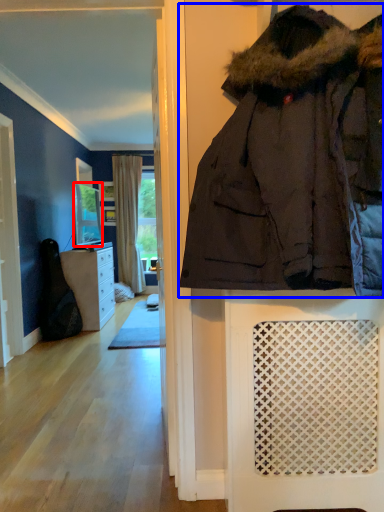
Question: Which object appears farthest to the camera in this image, mirror (highlighted by a red box) or jacket (highlighted by a blue box)?

Choices:
 (A) mirror
 (B) jacket

Answer: (A)